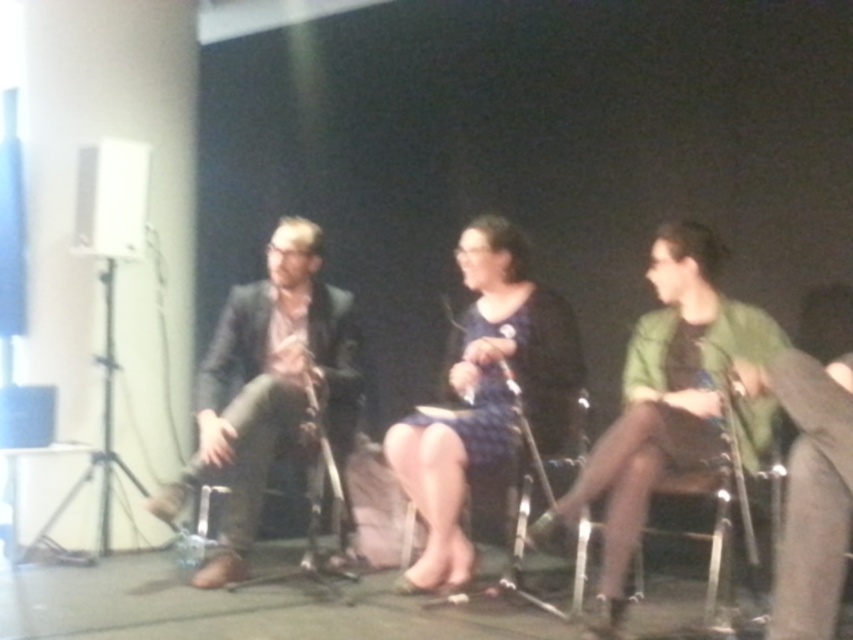
You are organizing a small event and need to decide whether to place a new decorative item on the green matte jacket at center or the wooden chair at center. Based on their sizes, which object would be more suitable for placing a larger decorative item?

The green matte jacket at center is larger in size than the wooden chair at center, so it would be more suitable for placing a larger decorative item.

Based on the photo, you are a photographer setting up for a panel discussion. You need to place a camera on the floor between the metallic silver chair at center and the wooden chair at center. However, the camera must be placed on a solid surface. Which chair should you place the camera on?

The metallic silver chair at center is positioned over wooden chair at center, so the camera should be placed on the metallic silver chair at center as it is above the wooden one and provides a solid surface.

The green matte jacket at center is located at which coordinate point?

The green matte jacket at center is located at point (662, 397).